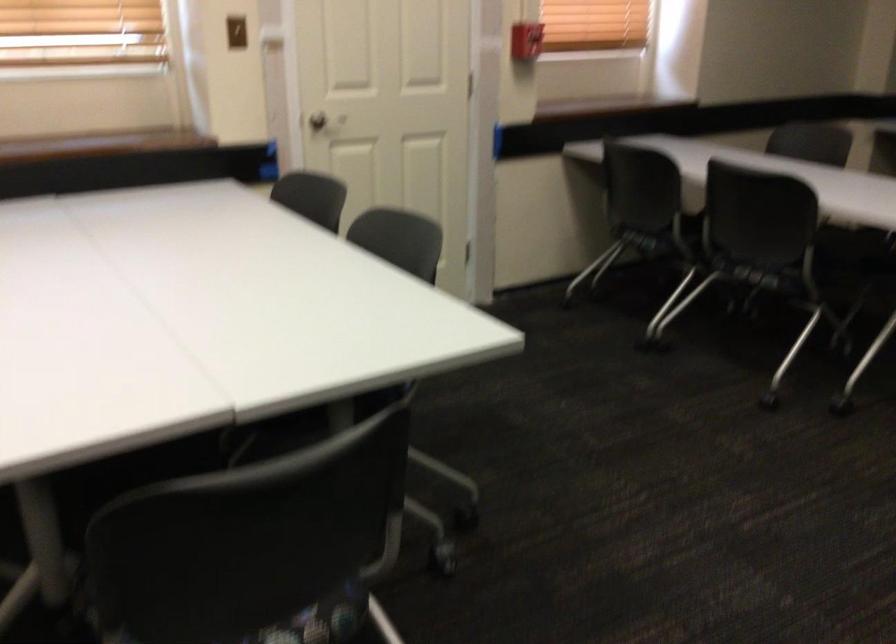
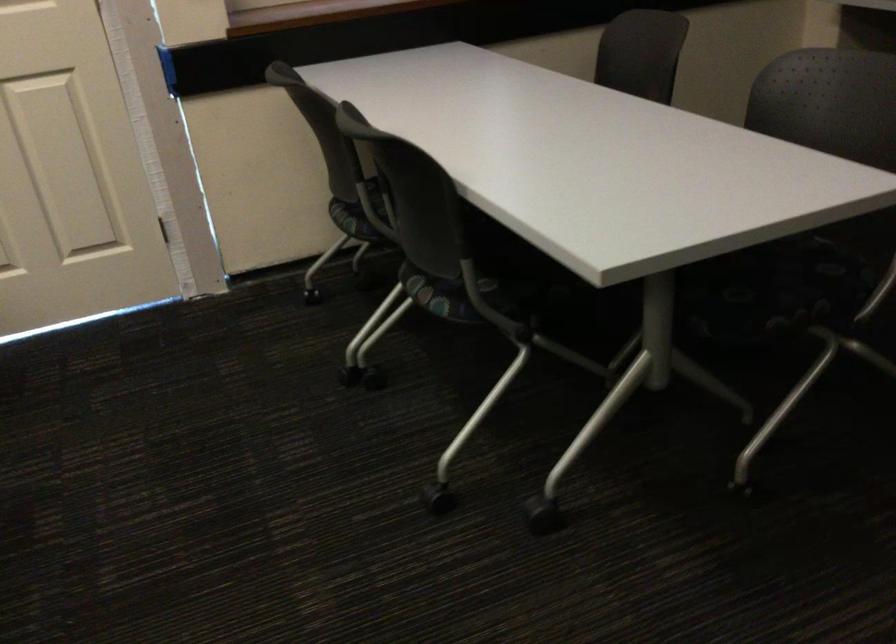
Find the pixel in the second image that matches (645,238) in the first image.

(350, 220)